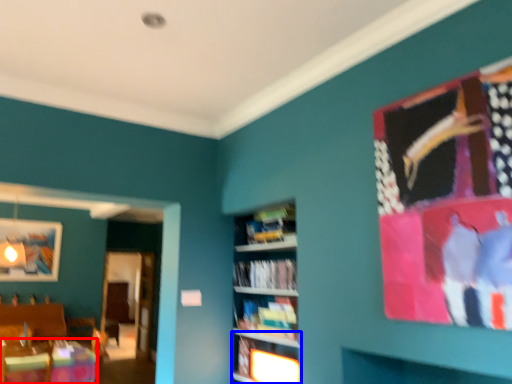
Question: Among these objects, which one is farthest to the camera, table (highlighted by a red box) or shelf (highlighted by a blue box)?

Choices:
 (A) table
 (B) shelf

Answer: (A)